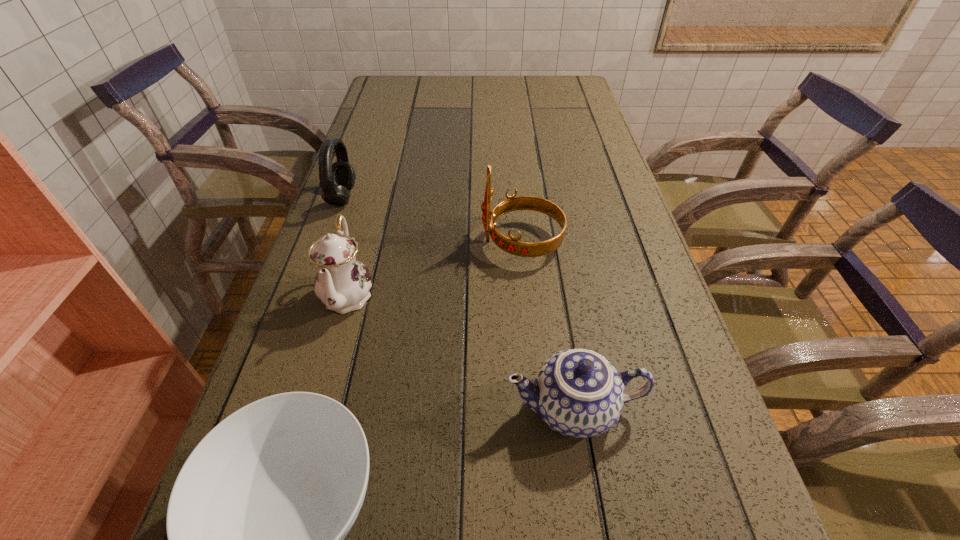
At what (x,y) coordinates should I click in order to perform the action: click on tiara. Please return your answer as a coordinate pair (x, y). The height and width of the screenshot is (540, 960). Looking at the image, I should click on (512, 245).

The width and height of the screenshot is (960, 540). In order to click on the farthest chinaware in this screenshot , I will do `click(342, 283)`.

At what (x,y) coordinates should I click in order to perform the action: click on headset. Please return your answer as a coordinate pair (x, y). The height and width of the screenshot is (540, 960). Looking at the image, I should click on (337, 179).

Find the location of a particular element. The image size is (960, 540). the rightmost chinaware is located at coordinates (578, 393).

Locate an element on the screen. vacant area located 0.250m on the front-facing side of the tallest object is located at coordinates (373, 242).

You are a GUI agent. You are given a task and a screenshot of the screen. Output one action in this format:
    pyautogui.click(x=<x>, y=<y>)
    Task: Click on the vacant space located 0.160m on the front-facing side of the tallest object
    The image size is (960, 540).
    Given the screenshot: What is the action you would take?
    pyautogui.click(x=412, y=242)

I want to click on vacant area situated on the front-facing side of the tallest object, so click(x=369, y=242).

You are a GUI agent. You are given a task and a screenshot of the screen. Output one action in this format:
    pyautogui.click(x=<x>, y=<y>)
    Task: Click on the free space located on the back of the tallest chinaware
    This screenshot has height=540, width=960.
    Given the screenshot: What is the action you would take?
    pyautogui.click(x=367, y=228)

At what (x,y) coordinates should I click in order to perform the action: click on vacant space located 0.330m on the earcups of the headset. Please return your answer as a coordinate pair (x, y). Looking at the image, I should click on (481, 198).

Identify the location of blank area located 0.050m from the spout of the rightmost chinaware. This screenshot has width=960, height=540. (475, 408).